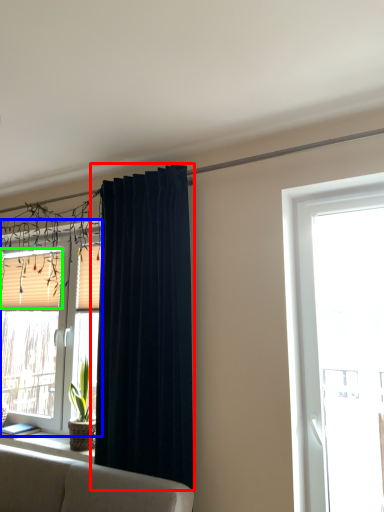
Question: Which object is positioned closest to curtain (highlighted by a red box)? Select from window (highlighted by a blue box) and shutter (highlighted by a green box).

Choices:
 (A) window
 (B) shutter

Answer: (B)